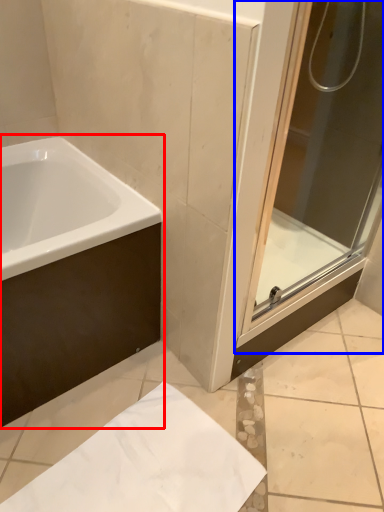
Question: Among these objects, which one is farthest to the camera, bathtub (highlighted by a red box) or screen door (highlighted by a blue box)?

Choices:
 (A) bathtub
 (B) screen door

Answer: (A)